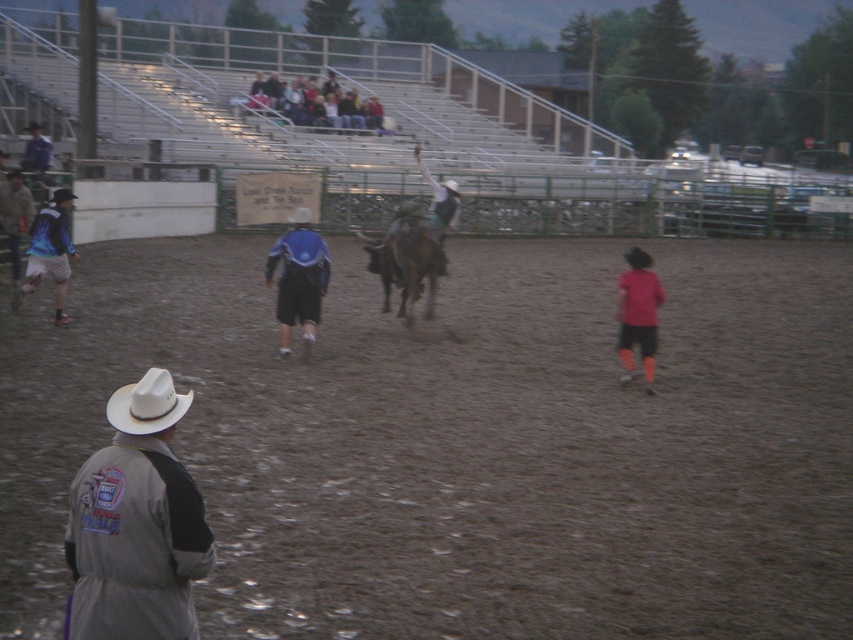
Question: Considering the real-world distances, which object is farthest from the blue fabric jacket at center?

Choices:
 (A) blue and white jacket at left
 (B) white matte cowboy hat at lower left

Answer: (B)

Question: Estimate the real-world distances between objects in this image. Which object is closer to the brown rough horse at center?

Choices:
 (A) blue fabric jacket at center
 (B) blue denim jeans at upper center
 (C) blue and white jacket at left

Answer: (C)

Question: Is brown dirt field at center bigger than light gray fabric jacket at lower left?

Choices:
 (A) yes
 (B) no

Answer: (A)

Question: Which object is the closest to the blue denim jeans at upper center?

Choices:
 (A) brown rough horse at center
 (B) blue and white jacket at left

Answer: (A)

Question: Is blue denim jeans at upper center below red matte shirt at right?

Choices:
 (A) no
 (B) yes

Answer: (A)

Question: Does brown rough horse at center have a smaller size compared to blue denim jeans at upper center?

Choices:
 (A) yes
 (B) no

Answer: (B)